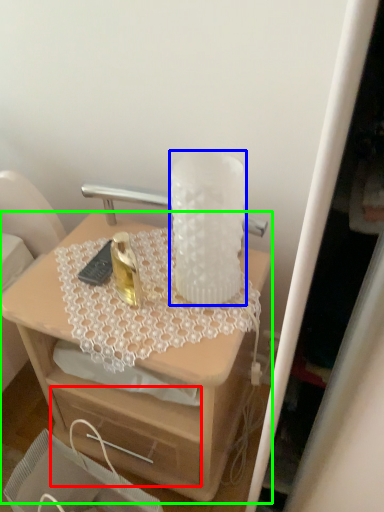
Question: Estimate the real-world distances between objects in this image. Which object is farther from drawer (highlighted by a red box), vase (highlighted by a blue box) or desk (highlighted by a green box)?

Choices:
 (A) vase
 (B) desk

Answer: (A)